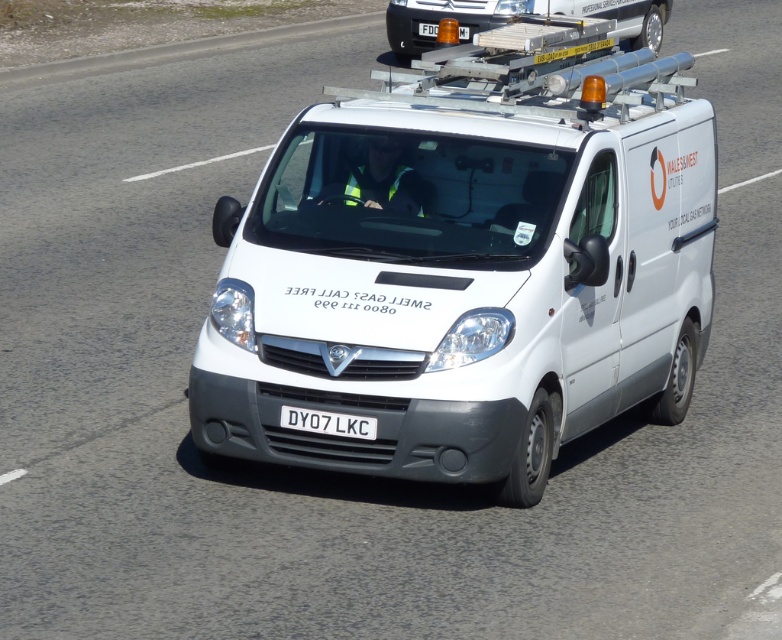
Measure the distance between white matte van at center and white metallic van at center.

The distance of white matte van at center from white metallic van at center is 13.02 meters.

Where is `white matte van at center`? This screenshot has width=782, height=640. white matte van at center is located at coordinates (467, 266).

You are a GUI agent. You are given a task and a screenshot of the screen. Output one action in this format:
    pyautogui.click(x=<x>, y=<y>)
    Task: Click on the white matte van at center
    
    Given the screenshot: What is the action you would take?
    pyautogui.click(x=467, y=266)

Find the location of a particular element. The width and height of the screenshot is (782, 640). white matte van at center is located at coordinates (467, 266).

Looking at this image, can you confirm if white matte van at center is smaller than white plastic license plate at center?

No.

Which is in front, point (540, 476) or point (339, 433)?

Point (339, 433) is more forward.

Find the location of `white matte van at center`. white matte van at center is located at coordinates (467, 266).

Between white metallic van at center and white plastic license plate at center, which one has more height?

white metallic van at center

Which is more to the right, white metallic van at center or white plastic license plate at center?

white metallic van at center

The width and height of the screenshot is (782, 640). Find the location of `white metallic van at center`. white metallic van at center is located at coordinates (515, 17).